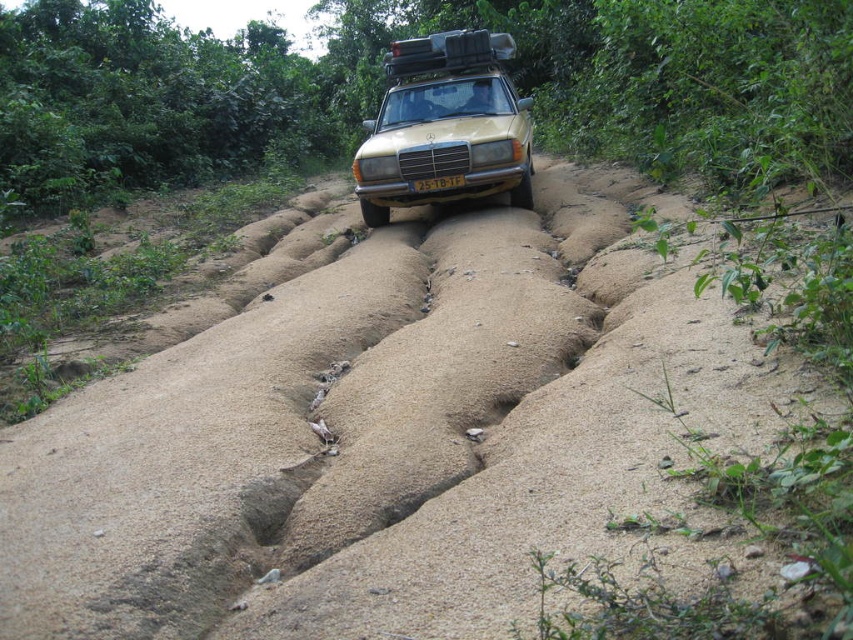
Question: Does gold matte car at center appear on the left side of yellow matte license plate at center?

Choices:
 (A) no
 (B) yes

Answer: (A)

Question: Which point is farther to the camera?

Choices:
 (A) gold matte car at center
 (B) yellow matte license plate at center

Answer: (B)

Question: Does gold matte car at center appear on the right side of yellow matte license plate at center?

Choices:
 (A) no
 (B) yes

Answer: (B)

Question: Is gold matte car at center behind yellow matte license plate at center?

Choices:
 (A) no
 (B) yes

Answer: (A)

Question: Which point appears closest to the camera in this image?

Choices:
 (A) [x=434, y=189]
 (B) [x=520, y=128]

Answer: (A)